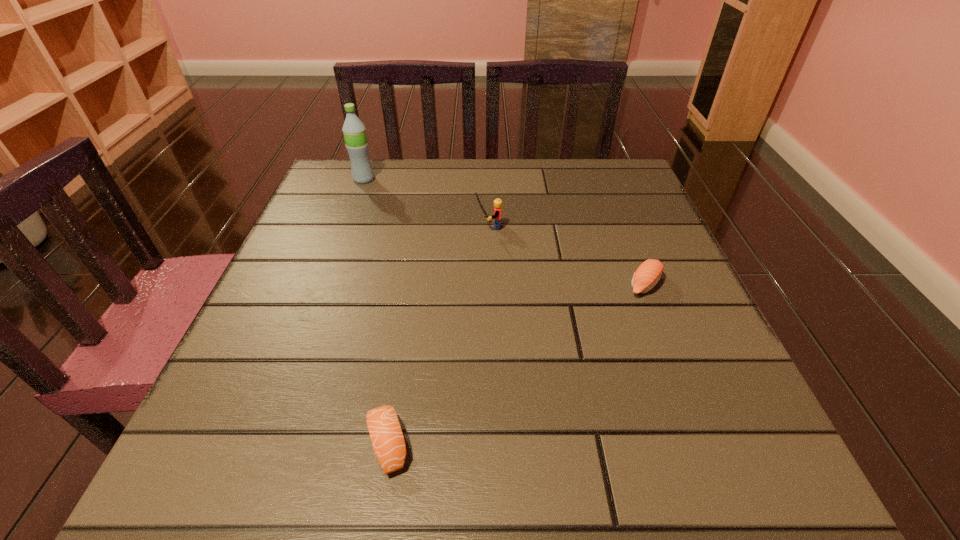
You are a GUI agent. You are given a task and a screenshot of the screen. Output one action in this format:
    pyautogui.click(x=<x>, y=<y>)
    Task: Click on the farthest object
    
    Given the screenshot: What is the action you would take?
    pyautogui.click(x=354, y=131)

Locate an element on the screen. The width and height of the screenshot is (960, 540). the tallest object is located at coordinates (354, 131).

Locate an element on the screen. This screenshot has height=540, width=960. Lego is located at coordinates (497, 202).

Identify the location of the second farthest object. (497, 202).

Locate an element on the screen. Image resolution: width=960 pixels, height=540 pixels. the taller sushi is located at coordinates (647, 275).

Where is `the third tallest object`? the third tallest object is located at coordinates (647, 275).

Locate an element on the screen. Image resolution: width=960 pixels, height=540 pixels. the nearer sushi is located at coordinates (389, 446).

Where is `the shorter sushi`? The image size is (960, 540). the shorter sushi is located at coordinates (389, 446).

The width and height of the screenshot is (960, 540). Identify the location of free spot located on the front of the leftmost object. (355, 203).

I want to click on free region located on the front-facing side of the third shortest object, so click(375, 227).